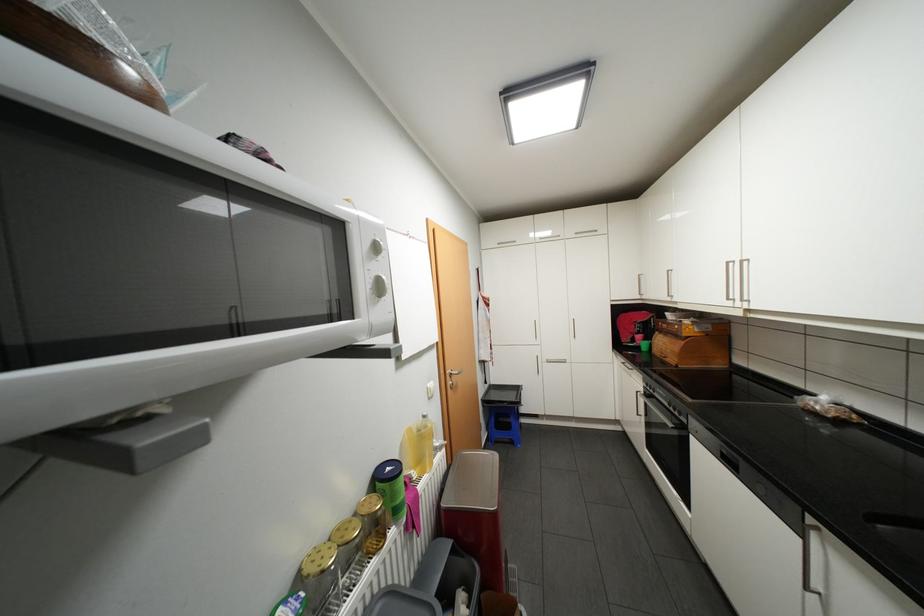
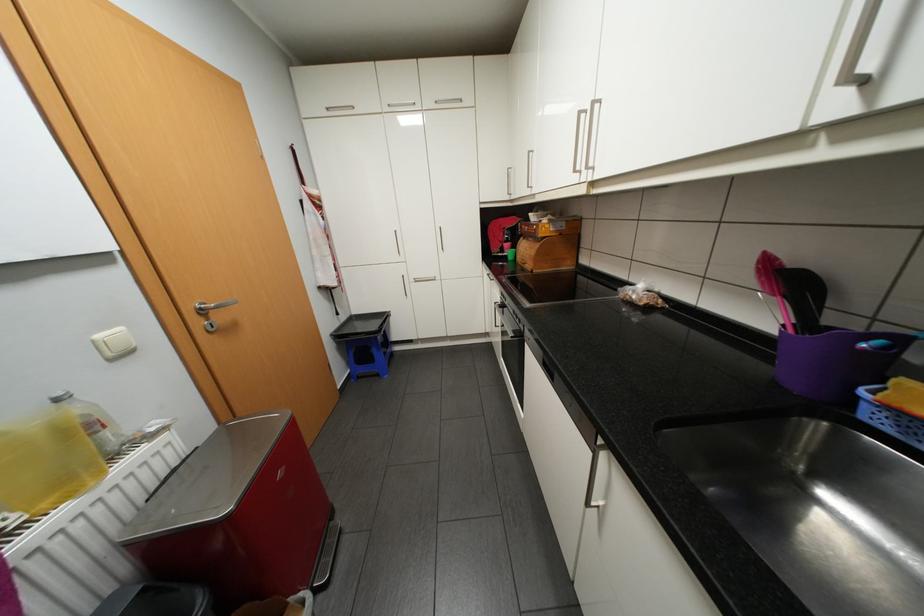
Locate, in the second image, the point that corresponds to (518,442) in the first image.

(385, 374)